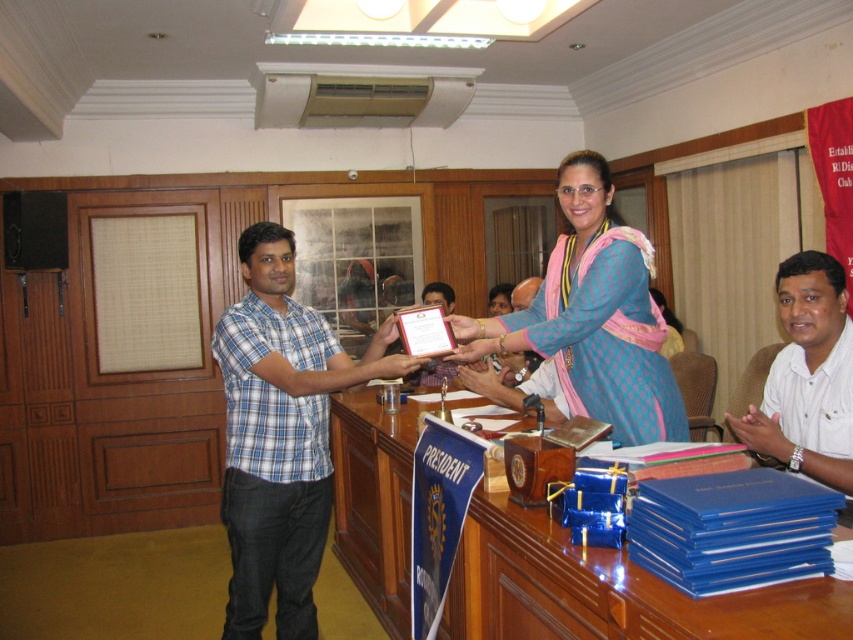
You are standing at the center of the room facing the large wooden desk. There are two points marked in the scene. The first point is at coordinates point (648, 588) and the second point is at point (788, 372). Which point is closer to you?

Point (648, 588) is in front of point (788, 372), so the first point is closer to you.

You are attending a formal event and need to place a gift on the shiny wooden table at center. If you are standing where the blue plaid shirt at center is, which direction should you move to reach the table?

Since the shiny wooden table at center is to the right of the blue plaid shirt at center, you should move to your right to reach the table.

You are organizing a small ceremony and need to place a 1.2 meter wide banner on the shiny wooden table at center. Considering the table size relative to the white matte shirt at lower right, can the banner fit on the table?

The shiny wooden table at center is wider than the white matte shirt at lower right. Since the table is wider than the shirt, and the banner is 1.2 meters wide, it is likely that the banner can fit on the table. However, without knowing the exact dimensions of the table, this is an approximate assessment.